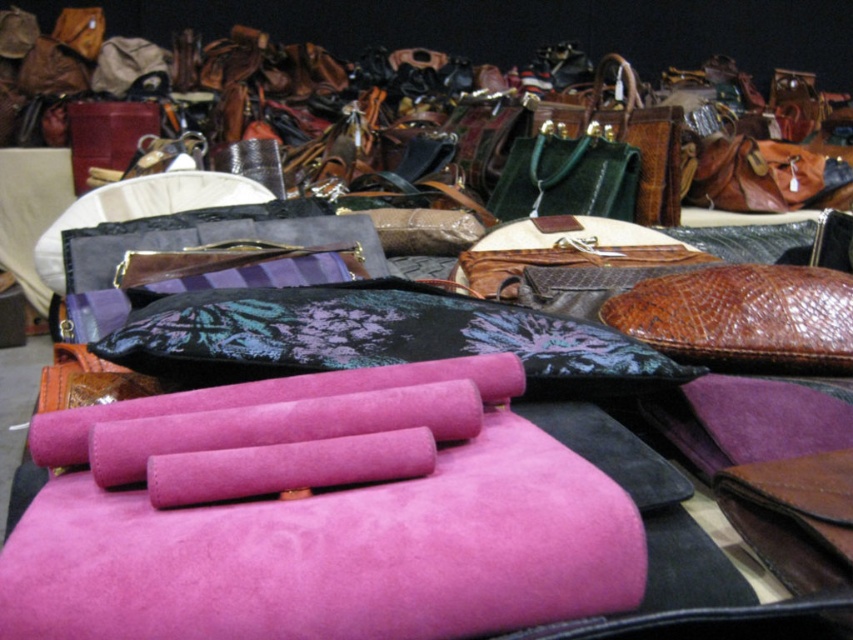
Question: Which object is closer to the camera taking this photo?

Choices:
 (A) suede pink yoga mat at center
 (B) black floral-patterned clutch at center

Answer: (A)

Question: Which of the following is the farthest from the observer?

Choices:
 (A) (265, 298)
 (B) (201, 563)

Answer: (A)

Question: Is suede pink yoga mat at center in front of black floral-patterned clutch at center?

Choices:
 (A) yes
 (B) no

Answer: (A)

Question: Can you confirm if suede pink yoga mat at center is positioned to the left of black floral-patterned clutch at center?

Choices:
 (A) yes
 (B) no

Answer: (A)

Question: Is suede pink yoga mat at center further to the viewer compared to black floral-patterned clutch at center?

Choices:
 (A) no
 (B) yes

Answer: (A)

Question: Which point is closer to the camera?

Choices:
 (A) (437, 577)
 (B) (283, 352)

Answer: (A)